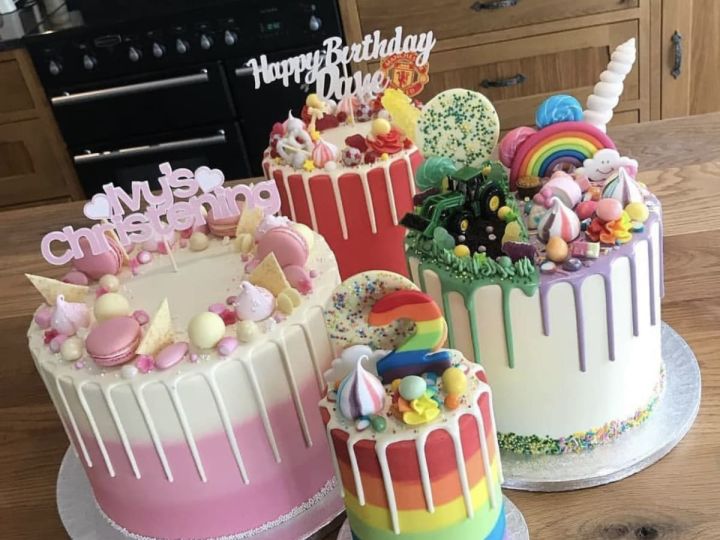
This screenshot has height=540, width=720. Find the location of `black oven`. black oven is located at coordinates (x=140, y=98), (x=234, y=48), (x=263, y=37).